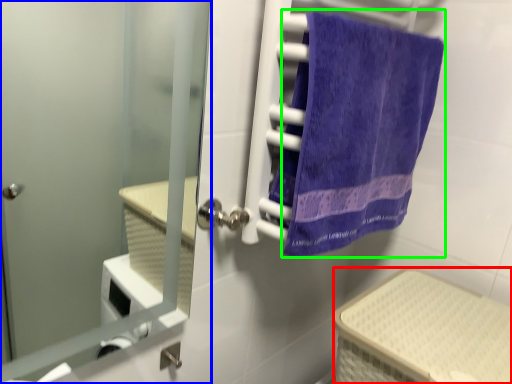
Question: Estimate the real-world distances between objects in this image. Which object is farther from basket (highlighted by a red box), door (highlighted by a blue box) or towel (highlighted by a green box)?

Choices:
 (A) door
 (B) towel

Answer: (A)